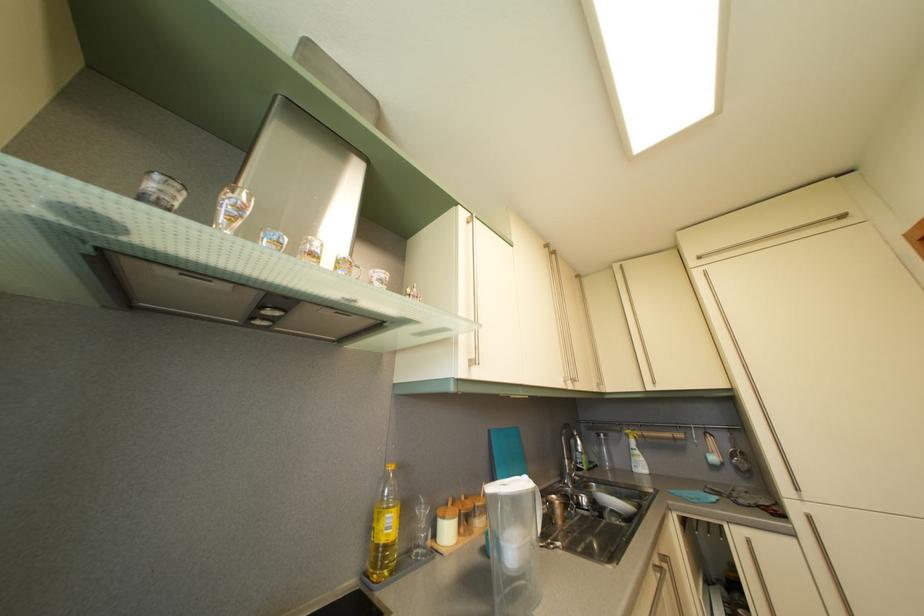
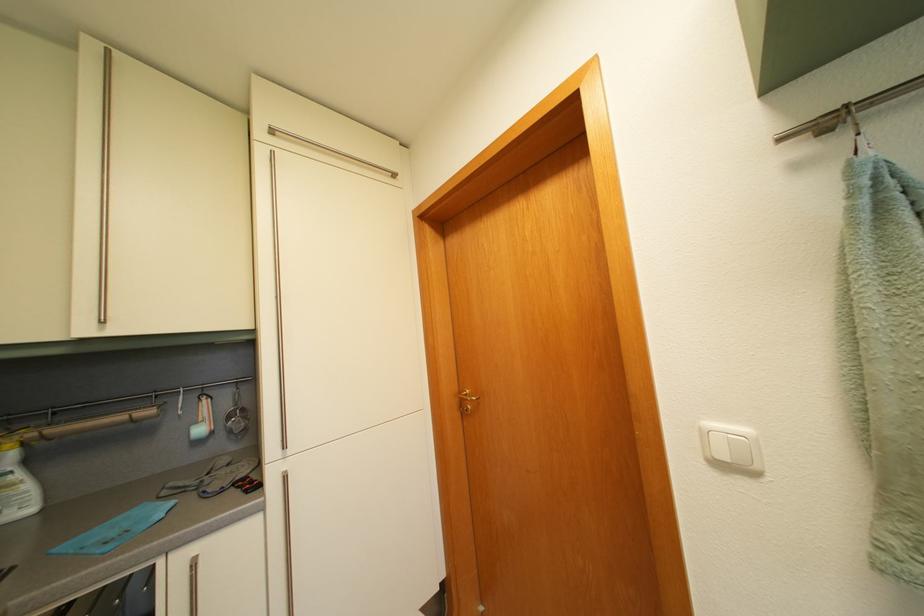
Where in the second image is the point corresponding to the point at 646,460 from the first image?

(26, 484)